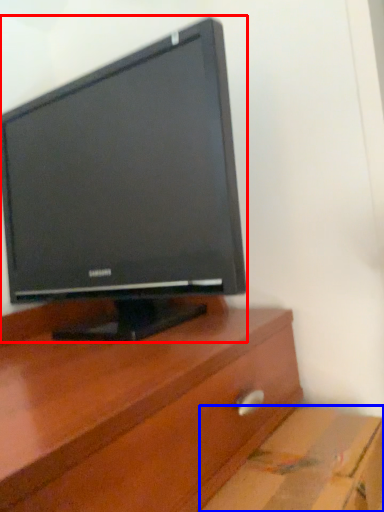
Question: Which of the following is the closest to the observer, computer monitor (highlighted by a red box) or cardboard box (highlighted by a blue box)?

Choices:
 (A) computer monitor
 (B) cardboard box

Answer: (B)